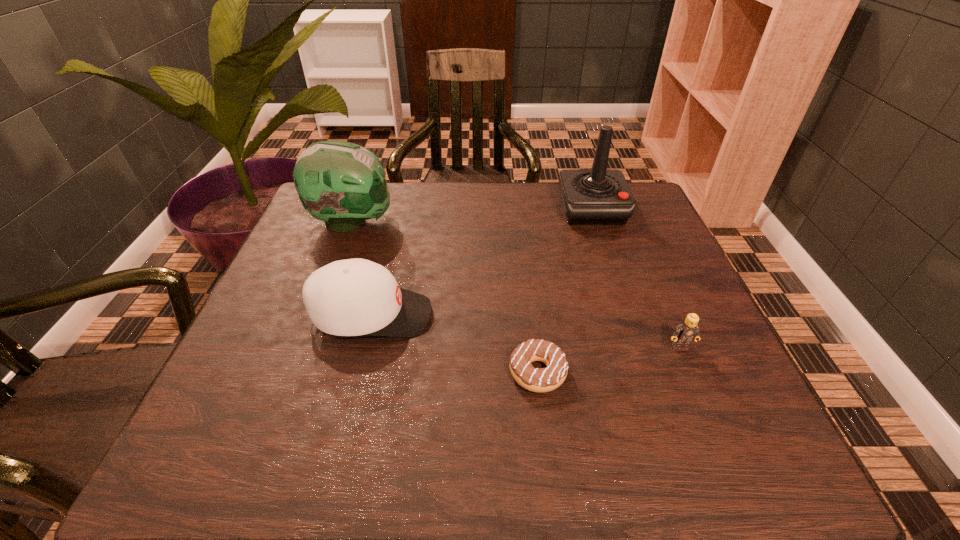
At what (x,y) coordinates should I click in order to perform the action: click on vacant space at the near edge of the desktop. Please return your answer as a coordinate pair (x, y). The width and height of the screenshot is (960, 540). Looking at the image, I should click on (637, 462).

Image resolution: width=960 pixels, height=540 pixels. In the image, there is a desktop. Find the location of `free region at the left edge`. free region at the left edge is located at coordinates (268, 333).

In the image, there is a desktop. Where is `vacant area at the right edge`? vacant area at the right edge is located at coordinates (670, 374).

This screenshot has height=540, width=960. What are the coordinates of `blank space at the far right corner` in the screenshot? It's located at (651, 221).

Where is `free space between the football helmet and the fourth tallest object`? free space between the football helmet and the fourth tallest object is located at coordinates (516, 284).

Find the location of a particular element. This screenshot has width=960, height=540. empty location between the football helmet and the third object from right to left is located at coordinates (444, 297).

The height and width of the screenshot is (540, 960). Find the location of `empty space that is in between the third shortest object and the joystick`. empty space that is in between the third shortest object and the joystick is located at coordinates (482, 262).

Find the location of a particular element. The height and width of the screenshot is (540, 960). free area in between the joystick and the third tallest object is located at coordinates (482, 262).

This screenshot has width=960, height=540. Identify the location of free spot between the doughnut and the second shortest object. (609, 360).

Locate an element on the screen. This screenshot has width=960, height=540. free point between the joystick and the third shortest object is located at coordinates (482, 262).